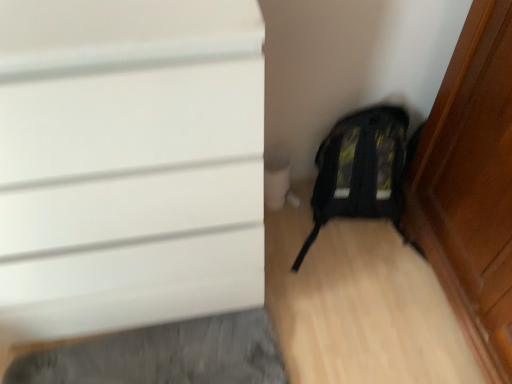
Question: Considering the positions of point (133, 236) and point (325, 177), is point (133, 236) closer or farther from the camera than point (325, 177)?

Choices:
 (A) closer
 (B) farther

Answer: (A)

Question: From the image's perspective, is white matte door at upper left located above or below black fabric backpack at lower right?

Choices:
 (A) below
 (B) above

Answer: (B)

Question: Is white matte door at upper left spatially inside black fabric backpack at lower right, or outside of it?

Choices:
 (A) inside
 (B) outside

Answer: (B)

Question: In the image, is black fabric backpack at lower right positioned in front of or behind white matte door at upper left?

Choices:
 (A) front
 (B) behind

Answer: (B)

Question: Is black fabric backpack at lower right inside or outside of white matte door at upper left?

Choices:
 (A) outside
 (B) inside

Answer: (A)

Question: Is point (349, 162) positioned closer to the camera than point (51, 36)?

Choices:
 (A) closer
 (B) farther

Answer: (B)

Question: In terms of size, does black fabric backpack at lower right appear bigger or smaller than white matte door at upper left?

Choices:
 (A) small
 (B) big

Answer: (A)